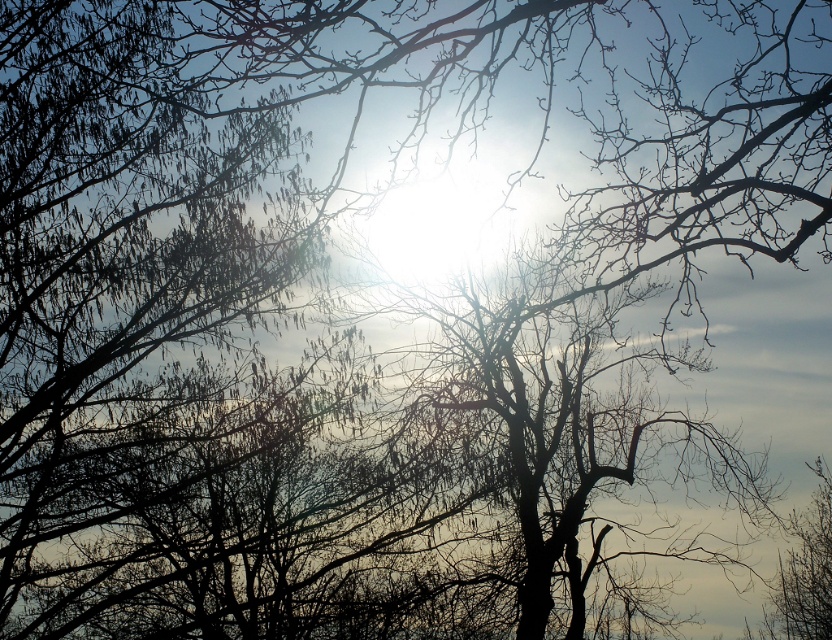
Which is above, silvery branches at upper left or black matte tree at center?

Positioned higher is silvery branches at upper left.

Does silvery branches at upper left appear on the left side of black matte tree at center?

Yes, silvery branches at upper left is to the left of black matte tree at center.

The height and width of the screenshot is (640, 832). Describe the element at coordinates (137, 332) in the screenshot. I see `silvery branches at upper left` at that location.

At what (x,y) coordinates should I click in order to perform the action: click on silvery branches at upper left. Please return your answer as a coordinate pair (x, y). This screenshot has height=640, width=832. Looking at the image, I should click on (137, 332).